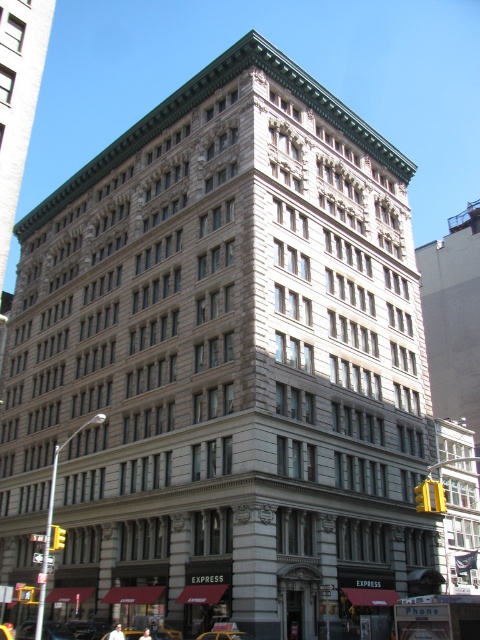
Question: Which point is farther from the camera taking this photo?

Choices:
 (A) (9, 625)
 (B) (55, 628)
 (C) (236, 632)

Answer: (A)

Question: Observing the image, what is the correct spatial positioning of yellow rubber taxi at lower center in reference to yellow rubber taxi at center?

Choices:
 (A) below
 (B) above

Answer: (B)

Question: Is metallic silver car at lower left positioned before yellow metallic taxi cab at lower center?

Choices:
 (A) yes
 (B) no

Answer: (B)

Question: Does metallic silver car at lower left have a larger size compared to yellow metallic taxi cab at lower center?

Choices:
 (A) no
 (B) yes

Answer: (B)

Question: Which point appears closest to the camera in this image?

Choices:
 (A) (2, 637)
 (B) (217, 634)

Answer: (A)

Question: Which point is closer to the camera?

Choices:
 (A) (19, 630)
 (B) (140, 636)

Answer: (B)